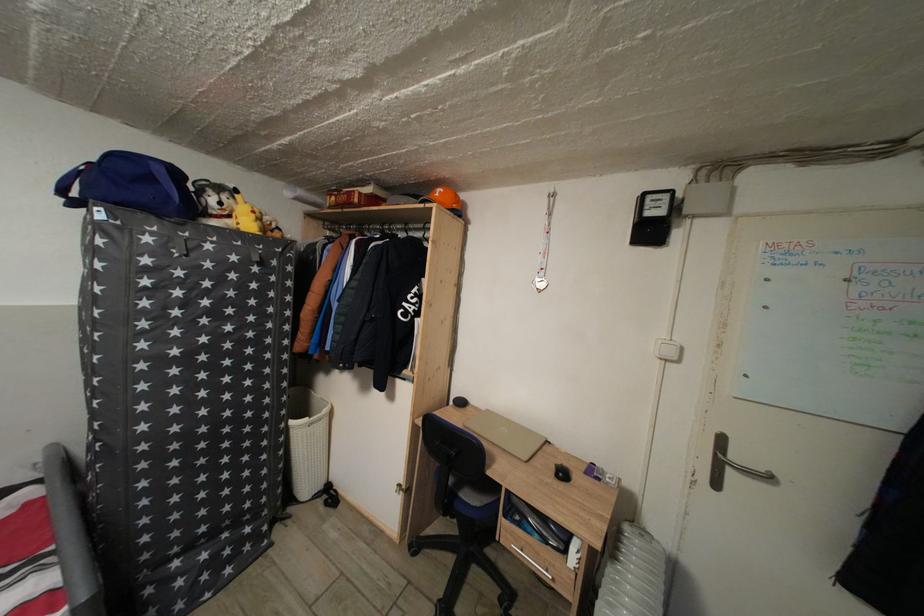
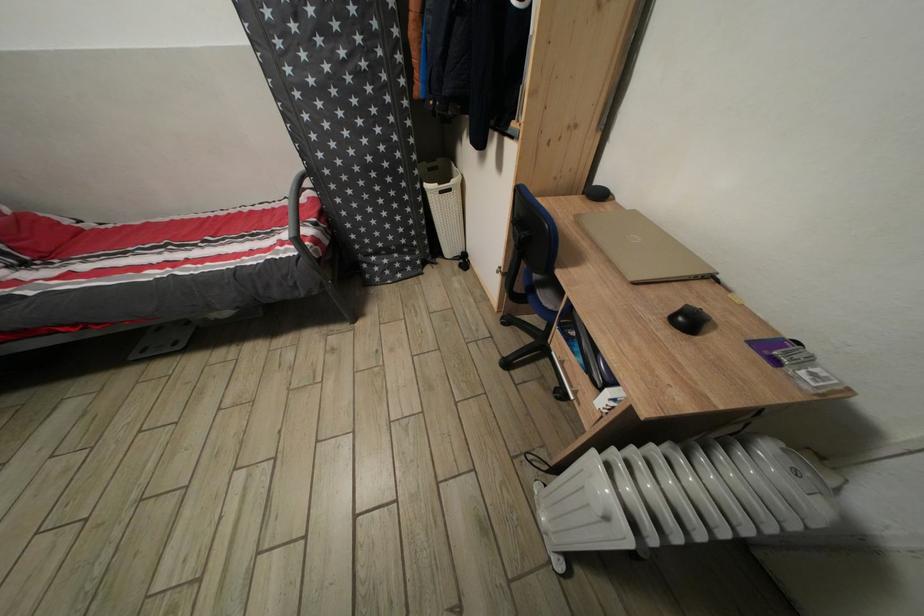
Locate, in the second image, the point that corresponds to point 298,429 in the first image.

(432, 192)